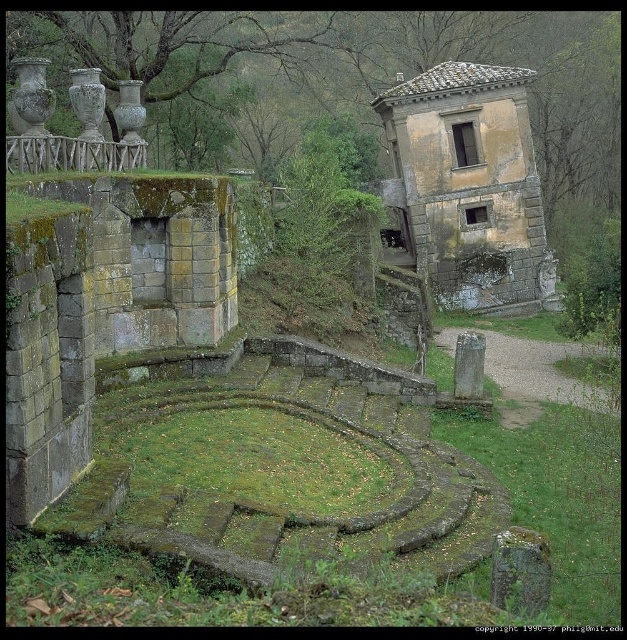
Question: Is yellow stone amphitheater at center to the left of green mossy stone at center from the viewer's perspective?

Choices:
 (A) no
 (B) yes

Answer: (A)

Question: Can you confirm if yellow stone amphitheater at center is wider than green mossy stone at center?

Choices:
 (A) no
 (B) yes

Answer: (A)

Question: Which of the following is the farthest from the observer?

Choices:
 (A) (557, 608)
 (B) (512, 304)

Answer: (B)

Question: Is yellow stone amphitheater at center thinner than green mossy stone at center?

Choices:
 (A) no
 (B) yes

Answer: (B)

Question: Which of the following is the closest to the observer?

Choices:
 (A) (391, 182)
 (B) (556, 616)

Answer: (B)

Question: Which point is closer to the camera?

Choices:
 (A) yellow stone amphitheater at center
 (B) green mossy stone at center

Answer: (B)